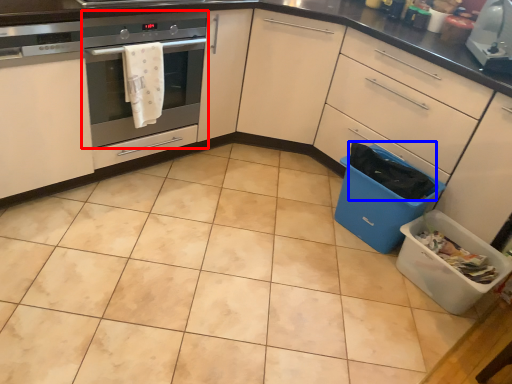
Question: Which object appears closest to the camera in this image, home appliance (highlighted by a red box) or material (highlighted by a blue box)?

Choices:
 (A) home appliance
 (B) material

Answer: (A)